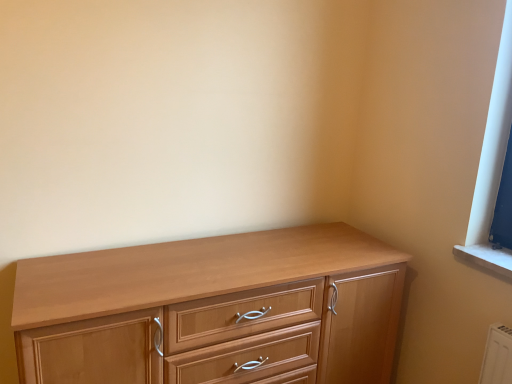
Find the location of a particular element. Image resolution: width=512 pixels, height=384 pixels. free space above light brown wood chest of drawers at lower left (from a real-world perspective) is located at coordinates (219, 261).